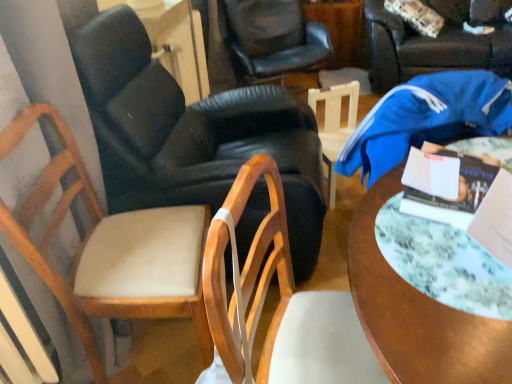
Question: Is hardcover book at center right taller or shorter than black leather chair at center, the fourth chair from the right?

Choices:
 (A) short
 (B) tall

Answer: (A)

Question: Would you say hardcover book at center right is to the left or to the right of black leather chair at center, the fourth chair from the right, in the picture?

Choices:
 (A) left
 (B) right

Answer: (B)

Question: Estimate the real-world distances between objects in this image. Which object is closer to the wooden chair at center, which ranks as the 4th chair in left-to-right order?

Choices:
 (A) leather armchair at center, the fifth chair viewed from the right
 (B) light brown wood chair at left, which is counted as the sixth chair, starting from the right
 (C) wooden round table at center
 (D) white wood chair at center, arranged as the 2th chair when viewed from the right
 (E) blue fabric chair at center, the 6th chair positioned from the left

Answer: (C)

Question: Considering the real-world distances, which object is closest to the hardcover book at center right?

Choices:
 (A) leather armchair at center, the fifth chair viewed from the right
 (B) white wood chair at center, which is the 5th chair from left to right
 (C) wooden round table at center
 (D) blue fabric chair at center, the 1th chair positioned from the right
 (E) wooden chair at center, which ranks as the 4th chair in left-to-right order

Answer: (C)